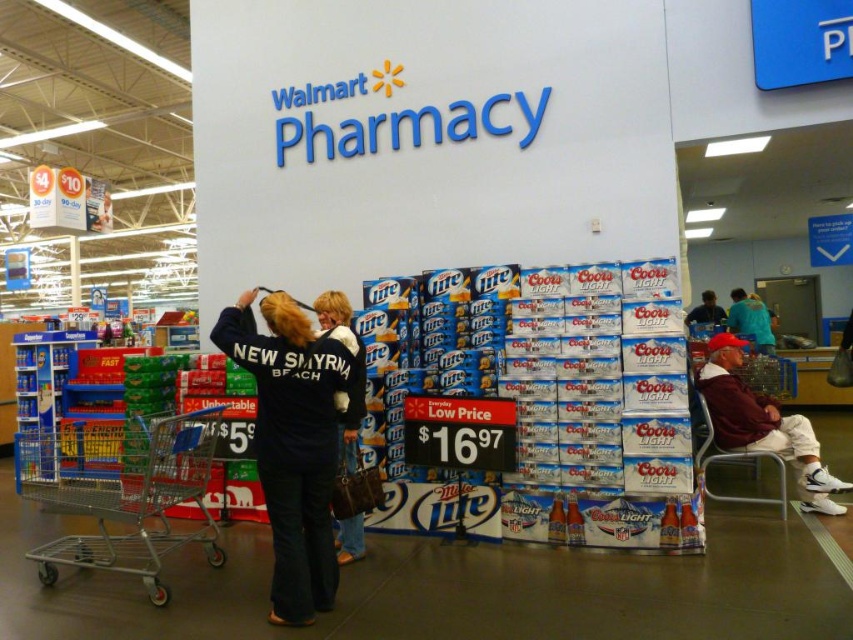
You are a store employee who needs to place a new sign between the dark blue fleece jacket at center and the metallic silver shopping cart at lower left. Which object should you place the sign closer to if you want the sign to be near the narrower item?

The dark blue fleece jacket at center is thinner than the metallic silver shopping cart at lower left, so the sign should be placed closer to the dark blue fleece jacket at center.

You are a customer in the Walmart pharmacy section. You see a metallic silver shopping cart at lower left and a teal fabric shirt at center. Which object is taller?

The metallic silver shopping cart at lower left is taller than the teal fabric shirt at center.

You are a customer in the Walmart pharmacy section and want to find the person wearing the dark blue denim jacket at center. Where would you look relative to the white cotton pants at lower right?

The dark blue denim jacket at center is above the white cotton pants at lower right, so you should look upwards from the white cotton pants at lower right to find the dark blue denim jacket at center.